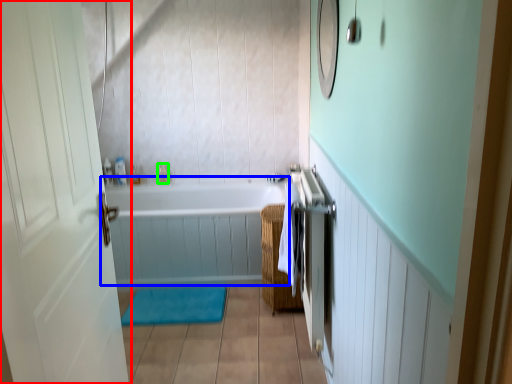
Question: Which is nearer to the door (highlighted by a red box)? bathtub (highlighted by a blue box) or toiletry (highlighted by a green box).

Choices:
 (A) bathtub
 (B) toiletry

Answer: (A)